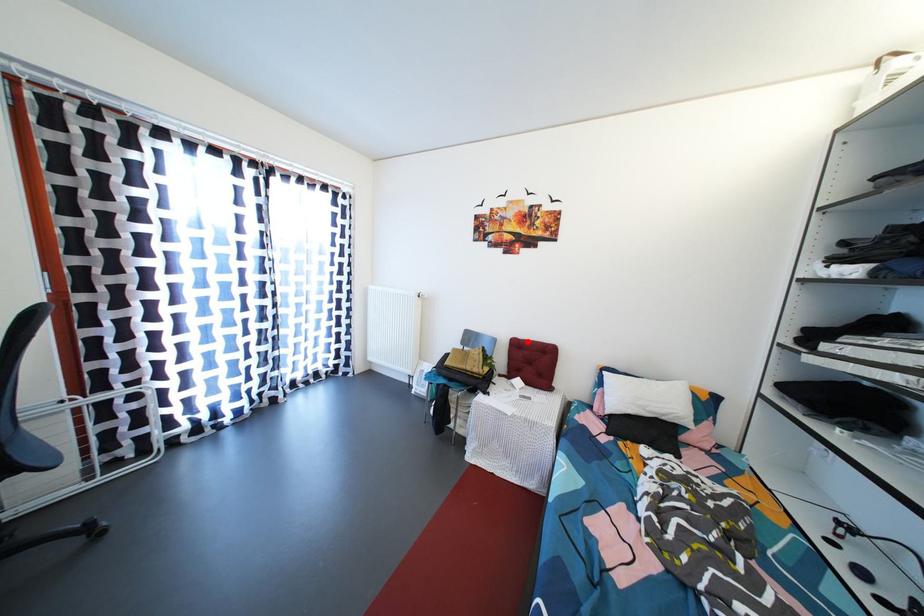
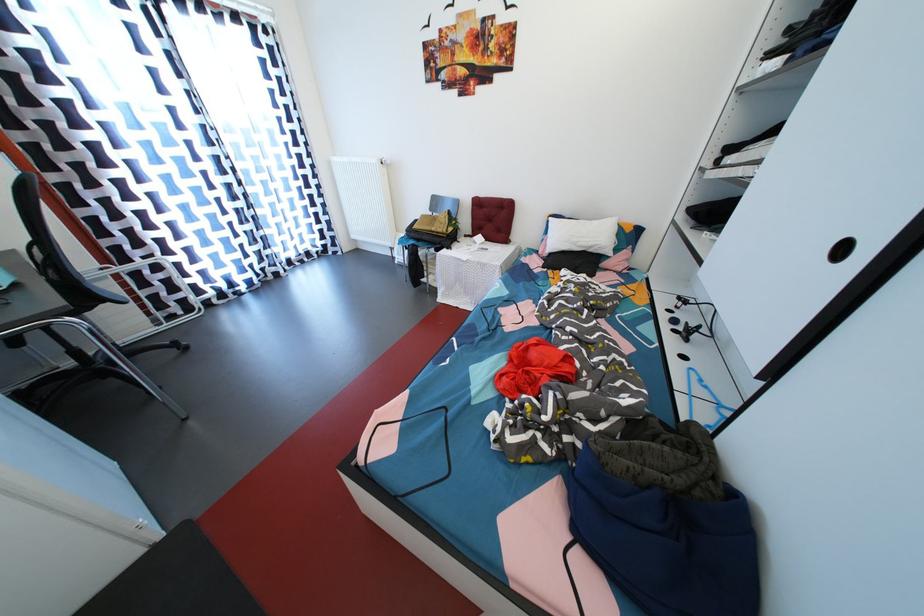
Locate, in the second image, the point that corresponds to the highlighted location in the first image.

(489, 200)